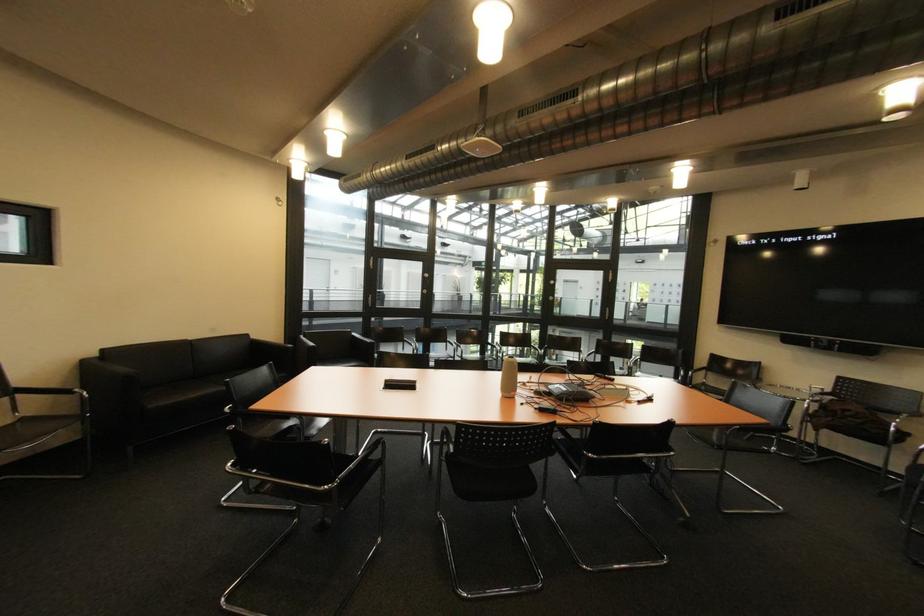
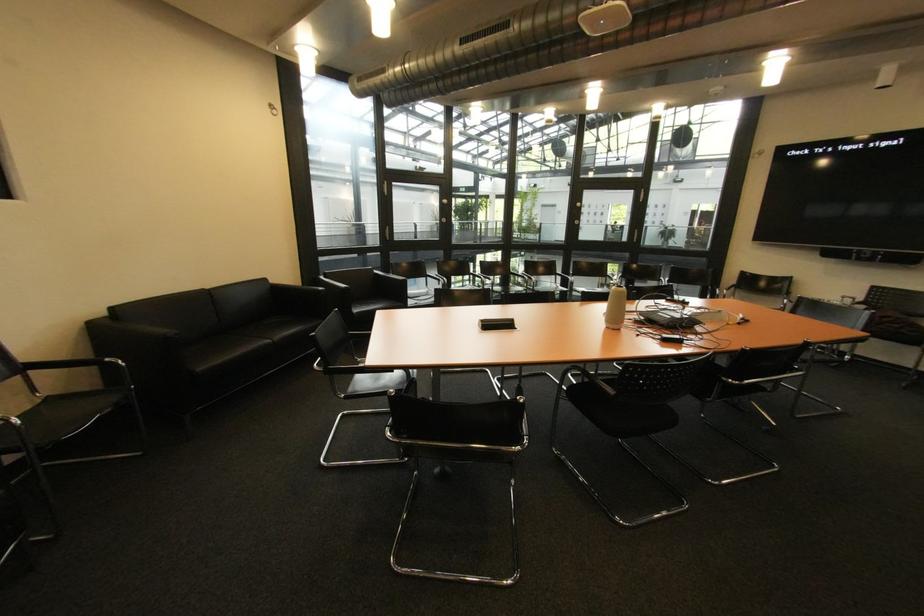
What movement of the cameraman would produce the second image?

The movement direction of the cameraman is left, forward.